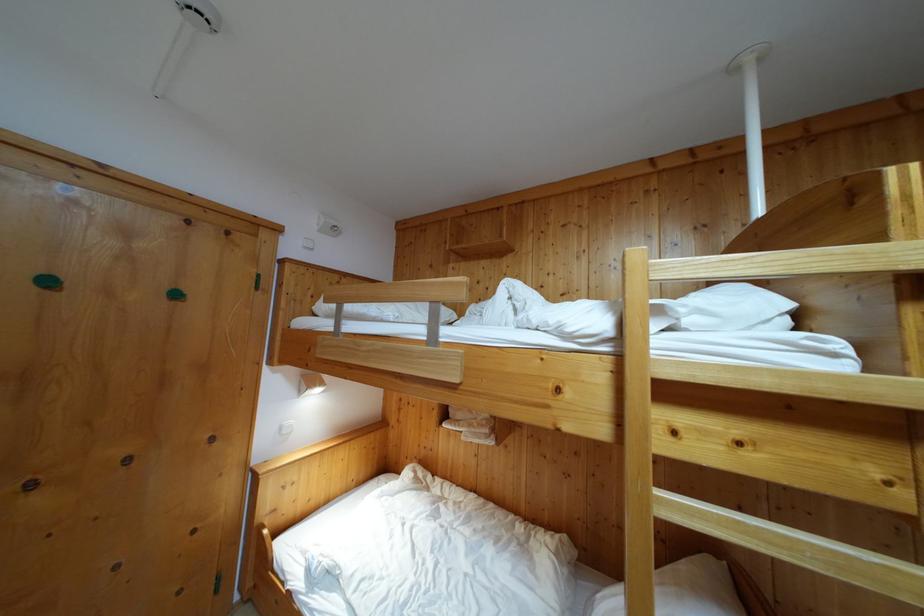
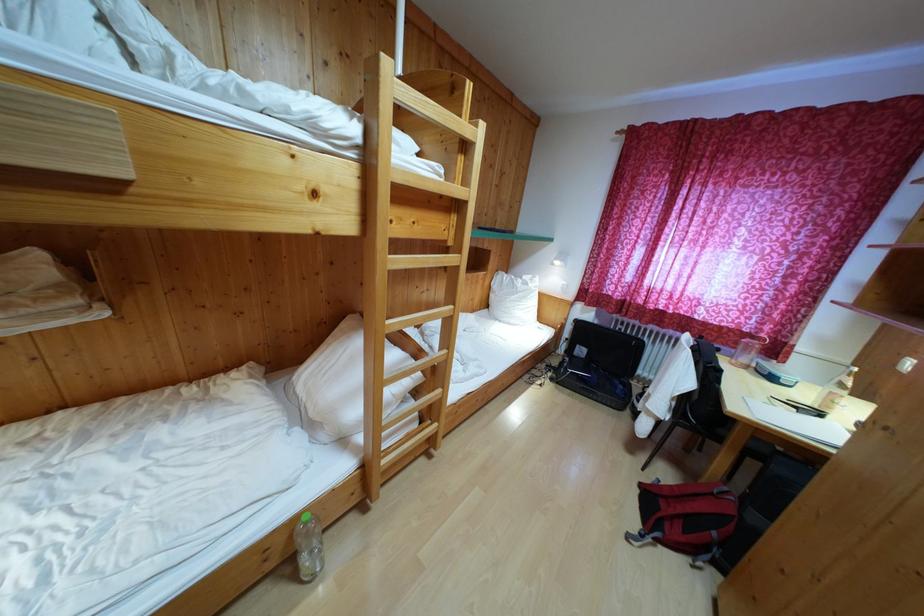
Based on the continuous images, in which direction is the camera rotating?

The rotation direction of the camera is right-down.